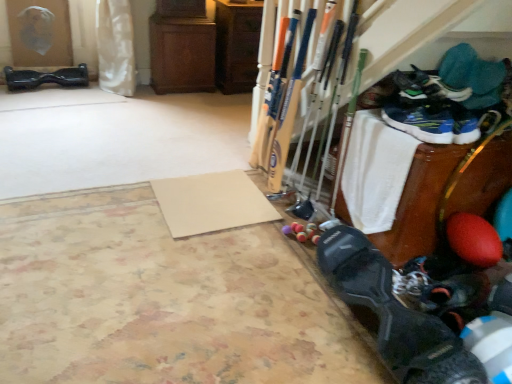
Question: Is beige matte yoga mat at center, which is the second yoga mat from front to back, situated inside blue synthetic shoe at upper right, placed as the sixth footwear when sorted from left to right, or outside?

Choices:
 (A) inside
 (B) outside

Answer: (B)

Question: Considering the positions of beige matte yoga mat at center, which is the second yoga mat from front to back, and blue synthetic shoe at upper right, the fifth footwear when ordered from front to back, in the image, is beige matte yoga mat at center, which is the second yoga mat from front to back, bigger or smaller than blue synthetic shoe at upper right, the fifth footwear when ordered from front to back,?

Choices:
 (A) big
 (B) small

Answer: (B)

Question: Estimate the real-world distances between objects in this image. Which object is closer to the beige textured yoga mat at lower left, the 1th yoga mat when ordered from front to back?

Choices:
 (A) black matte shoe at lower right, the first footwear in the front-to-back sequence
 (B) green suede sneakers at upper right, acting as the fourth footwear starting from the bottom
 (C) matte black hoverboard at left, which ranks as the sixth footwear in bottom-to-top order
 (D) beige matte yoga mat at center, which is the second yoga mat from front to back
 (E) blue mesh sneakers at lower right, which is the 4th footwear in left-to-right order

Answer: (D)

Question: Based on their relative distances, which object is farther from the black matte shoe at lower right, the first footwear in the front-to-back sequence?

Choices:
 (A) matte black hoverboard at left, which is the 1th footwear from back to front
 (B) blue synthetic shoe at upper right, marked as the first footwear in a right-to-left arrangement
 (C) beige matte yoga mat at center, which is the second yoga mat from front to back
 (D) black matte shoe at lower right, arranged as the 2th footwear when ordered from the bottom
 (E) blue mesh sneakers at lower right, the 4th footwear from the top

Answer: (A)